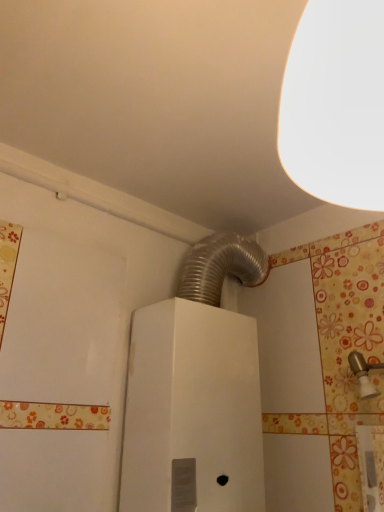
Question: Is brushed metal faucet at upper right facing towards white metallic water heater at center?

Choices:
 (A) no
 (B) yes

Answer: (A)

Question: Is brushed metal faucet at upper right directly adjacent to white metallic water heater at center?

Choices:
 (A) no
 (B) yes

Answer: (A)

Question: Is brushed metal faucet at upper right in front of white metallic water heater at center?

Choices:
 (A) no
 (B) yes

Answer: (B)

Question: Would you say brushed metal faucet at upper right contains white metallic water heater at center?

Choices:
 (A) yes
 (B) no

Answer: (B)

Question: Can you confirm if brushed metal faucet at upper right is bigger than white metallic water heater at center?

Choices:
 (A) no
 (B) yes

Answer: (A)

Question: Is brushed metal faucet at upper right at the right side of white metallic water heater at center?

Choices:
 (A) yes
 (B) no

Answer: (A)

Question: Is the depth of white metallic water heater at center greater than that of white matte lampshade at upper right?

Choices:
 (A) yes
 (B) no

Answer: (A)

Question: Can you confirm if white metallic water heater at center is taller than white matte lampshade at upper right?

Choices:
 (A) no
 (B) yes

Answer: (B)

Question: Is white metallic water heater at center shorter than white matte lampshade at upper right?

Choices:
 (A) no
 (B) yes

Answer: (A)

Question: Are white metallic water heater at center and white matte lampshade at upper right far apart?

Choices:
 (A) yes
 (B) no

Answer: (B)

Question: From a real-world perspective, is white metallic water heater at center positioned under white matte lampshade at upper right based on gravity?

Choices:
 (A) yes
 (B) no

Answer: (A)

Question: Is white metallic water heater at center positioned in front of white matte lampshade at upper right?

Choices:
 (A) yes
 (B) no

Answer: (B)

Question: Is white matte lampshade at upper right aimed at brushed metal faucet at upper right?

Choices:
 (A) yes
 (B) no

Answer: (B)